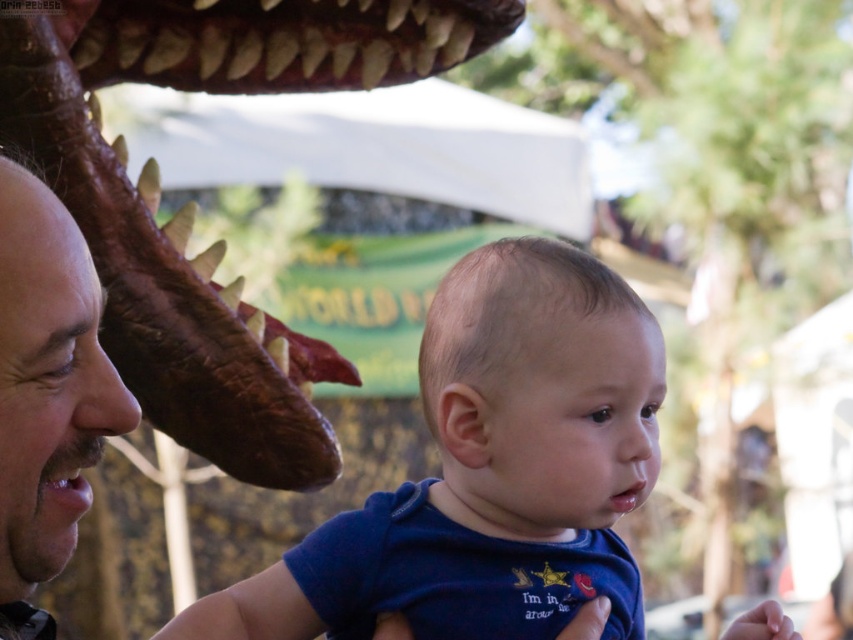
You are a parent holding a baby wearing a blue cotton shirt at center and a smooth brown leather face at left. You want to place a 12 inch long stuffed animal between them. Is there enough space?

The distance between the blue cotton shirt at center and the smooth brown leather face at left is 34.18 inches, so yes, there is enough space to place a 12 inch long stuffed animal between them since 34.18 inches is greater than 12 inches.

You are a photographer trying to capture a clear shot of the blue cotton shirt at center and the brown textured head at upper left. Since the background is blurry, can you tell which object is closer to the camera?

The blue cotton shirt at center is located below the brown textured head at upper left, so the brown textured head at upper left is closer to the camera.